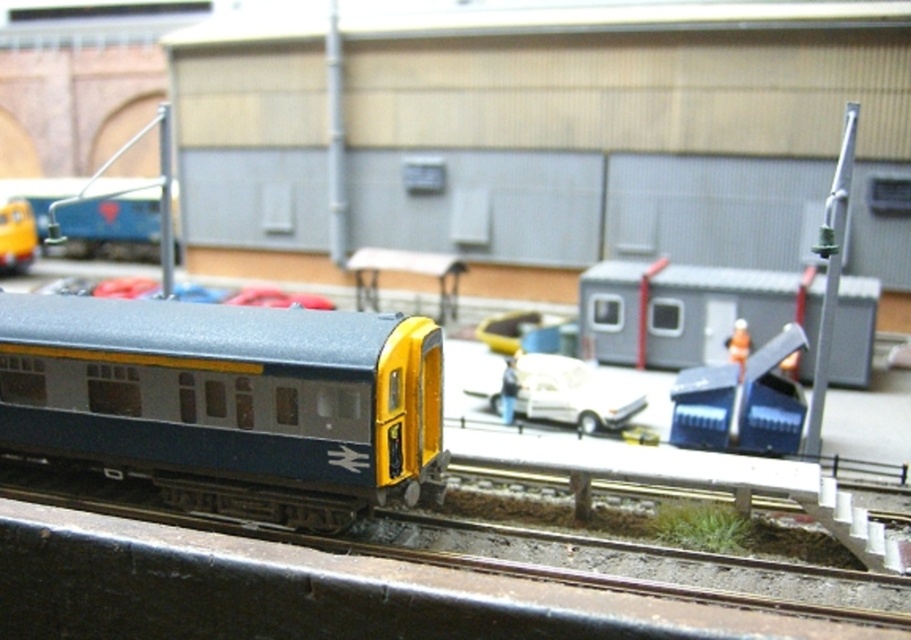
Question: Which point is closer to the camera taking this photo?

Choices:
 (A) (362, 435)
 (B) (495, 397)

Answer: (A)

Question: In this image, where is metallic blue train at center located relative to white matte car at center?

Choices:
 (A) right
 (B) left

Answer: (B)

Question: Is metallic blue train at center closer to camera compared to white matte car at center?

Choices:
 (A) no
 (B) yes

Answer: (B)

Question: Which point is farther to the camera?

Choices:
 (A) white matte car at center
 (B) metallic blue train at center

Answer: (A)

Question: Does metallic blue train at center have a greater width compared to white matte car at center?

Choices:
 (A) yes
 (B) no

Answer: (A)

Question: Among these points, which one is nearest to the camera?

Choices:
 (A) (589, 428)
 (B) (9, 321)

Answer: (B)